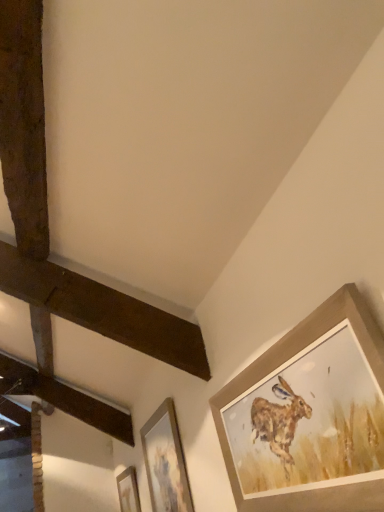
What is the approximate width of wooden picture frame at lower center, which is the first picture frame in left-to-right order?

wooden picture frame at lower center, which is the first picture frame in left-to-right order, is 1.90 inches in width.

The width and height of the screenshot is (384, 512). What do you see at coordinates (309, 415) in the screenshot?
I see `wooden picture frame at upper right, placed as the 1th picture frame when sorted from top to bottom` at bounding box center [309, 415].

What do you see at coordinates (166, 461) in the screenshot? I see `wooden picture frame at center, which appears as the 2th picture frame when viewed from the front` at bounding box center [166, 461].

Where is `wooden picture frame at lower center, the third picture frame when ordered from front to back`? The image size is (384, 512). wooden picture frame at lower center, the third picture frame when ordered from front to back is located at coordinates coord(128,490).

Looking at their sizes, would you say wooden picture frame at lower center, the 3th picture frame viewed from the right, is wider or thinner than wooden picture frame at center, the 2th picture frame in the bottom-to-top sequence?

Clearly, wooden picture frame at lower center, the 3th picture frame viewed from the right, has less width compared to wooden picture frame at center, the 2th picture frame in the bottom-to-top sequence.

Would you consider wooden picture frame at lower center, which is the 1th picture frame from back to front, to be distant from wooden picture frame at center, which appears as the 2th picture frame when viewed from the front?

Yes, wooden picture frame at lower center, which is the 1th picture frame from back to front, and wooden picture frame at center, which appears as the 2th picture frame when viewed from the front, are located far from each other.

At what (x,y) coordinates should I click in order to perform the action: click on picture frame that appears above the wooden picture frame at lower center, placed as the first picture frame when sorted from bottom to top (from a real-world perspective). Please return your answer as a coordinate pair (x, y). Looking at the image, I should click on (166, 461).

Could you tell me if wooden picture frame at lower center, which is the 1th picture frame from back to front, is facing wooden picture frame at center, placed as the second picture frame when sorted from left to right?

No.

Does wooden picture frame at center, the 2th picture frame from the right, turn towards wooden picture frame at lower center, which is the 1th picture frame from back to front?

No, wooden picture frame at center, the 2th picture frame from the right, is not facing towards wooden picture frame at lower center, which is the 1th picture frame from back to front.

Considering the sizes of wooden picture frame at center, the 2th picture frame viewed from the back, and wooden picture frame at lower center, positioned as the third picture frame in top-to-bottom order, in the image, is wooden picture frame at center, the 2th picture frame viewed from the back, taller or shorter than wooden picture frame at lower center, positioned as the third picture frame in top-to-bottom order,?

Clearly, wooden picture frame at center, the 2th picture frame viewed from the back, is taller compared to wooden picture frame at lower center, positioned as the third picture frame in top-to-bottom order.

Is wooden picture frame at center, the second picture frame when ordered from top to bottom, located outside wooden picture frame at lower center, the 3th picture frame viewed from the right?

Yes.

Can you tell me how much wooden picture frame at lower center, positioned as the third picture frame in top-to-bottom order, and wooden picture frame at upper right, marked as the 3th picture frame in a back-to-front arrangement, differ in facing direction?

There is a 0.000622-degree angle between the facing directions of wooden picture frame at lower center, positioned as the third picture frame in top-to-bottom order, and wooden picture frame at upper right, marked as the 3th picture frame in a back-to-front arrangement.

Is wooden picture frame at lower center, the third picture frame when ordered from front to back, positioned with its back to wooden picture frame at upper right, which is the 3th picture frame from bottom to top?

wooden picture frame at lower center, the third picture frame when ordered from front to back, does not have its back to wooden picture frame at upper right, which is the 3th picture frame from bottom to top.

Can you confirm if wooden picture frame at lower center, placed as the first picture frame when sorted from bottom to top, is wider than wooden picture frame at upper right, marked as the 3th picture frame in a back-to-front arrangement?

Incorrect, the width of wooden picture frame at lower center, placed as the first picture frame when sorted from bottom to top, does not surpass that of wooden picture frame at upper right, marked as the 3th picture frame in a back-to-front arrangement.

From the image's perspective, is wooden picture frame at lower center, which is the 1th picture frame from back to front, positioned above or below wooden picture frame at upper right, marked as the 3th picture frame in a back-to-front arrangement?

wooden picture frame at lower center, which is the 1th picture frame from back to front, is situated lower than wooden picture frame at upper right, marked as the 3th picture frame in a back-to-front arrangement, in the image.

Which of these two, wooden picture frame at upper right, marked as the 3th picture frame in a back-to-front arrangement, or wooden picture frame at center, placed as the second picture frame when sorted from left to right, is bigger?

Bigger between the two is wooden picture frame at upper right, marked as the 3th picture frame in a back-to-front arrangement.

Between wooden picture frame at upper right, which is the 3th picture frame from bottom to top, and wooden picture frame at center, the 2th picture frame in the bottom-to-top sequence, which one appears on the right side from the viewer's perspective?

Positioned to the right is wooden picture frame at upper right, which is the 3th picture frame from bottom to top.

Based on the photo, does wooden picture frame at upper right, marked as the 3th picture frame in a back-to-front arrangement, have a lesser height compared to wooden picture frame at lower center, the third picture frame when ordered from front to back?

No, wooden picture frame at upper right, marked as the 3th picture frame in a back-to-front arrangement, is not shorter than wooden picture frame at lower center, the third picture frame when ordered from front to back.

Visually, is wooden picture frame at upper right, marked as the 3th picture frame in a back-to-front arrangement, positioned to the left or to the right of wooden picture frame at lower center, the 3th picture frame viewed from the right?

wooden picture frame at upper right, marked as the 3th picture frame in a back-to-front arrangement, is to the right of wooden picture frame at lower center, the 3th picture frame viewed from the right.

Where is `picture frame directly beneath the wooden picture frame at lower center, which is the 1th picture frame from back to front (from a real-world perspective)`? picture frame directly beneath the wooden picture frame at lower center, which is the 1th picture frame from back to front (from a real-world perspective) is located at coordinates (309, 415).

Is wooden picture frame at center, the 2th picture frame viewed from the back, turned away from wooden picture frame at upper right, marked as the 3th picture frame in a back-to-front arrangement?

wooden picture frame at center, the 2th picture frame viewed from the back, does not have its back to wooden picture frame at upper right, marked as the 3th picture frame in a back-to-front arrangement.

Is the depth of wooden picture frame at center, which appears as the 2th picture frame when viewed from the front, less than that of wooden picture frame at upper right, acting as the first picture frame starting from the right?

No, wooden picture frame at center, which appears as the 2th picture frame when viewed from the front, is further to the viewer.

Considering the positions of points (185, 471) and (378, 477), is point (185, 471) closer to camera compared to point (378, 477)?

No, it is not.

Which picture frame is the 1st one when counting from the front of the wooden picture frame at lower center, which is the first picture frame in left-to-right order? Please provide its 2D coordinates.

[(166, 461)]

Locate an element on the screen. The height and width of the screenshot is (512, 384). picture frame that is below the wooden picture frame at center, the 2th picture frame in the bottom-to-top sequence (from the image's perspective) is located at coordinates (128, 490).

Looking at the image, which one is located further to wooden picture frame at lower center, the 3th picture frame viewed from the right, wooden picture frame at center, the 2th picture frame viewed from the back, or wooden picture frame at upper right, the third picture frame positioned from the left?

Based on the image, wooden picture frame at upper right, the third picture frame positioned from the left, appears to be further to wooden picture frame at lower center, the 3th picture frame viewed from the right.

Considering their positions, is wooden picture frame at lower center, the 3th picture frame viewed from the right, positioned closer to wooden picture frame at upper right, acting as the first picture frame starting from the right, than wooden picture frame at center, which appears as the 2th picture frame when viewed from the front?

Among the two, wooden picture frame at center, which appears as the 2th picture frame when viewed from the front, is located nearer to wooden picture frame at upper right, acting as the first picture frame starting from the right.

Based on their spatial positions, is wooden picture frame at upper right, marked as the 3th picture frame in a back-to-front arrangement, or wooden picture frame at lower center, which is the 1th picture frame from back to front, further from wooden picture frame at center, the 2th picture frame in the bottom-to-top sequence?

The object further to wooden picture frame at center, the 2th picture frame in the bottom-to-top sequence, is wooden picture frame at upper right, marked as the 3th picture frame in a back-to-front arrangement.

From the image, which object appears to be farther from wooden picture frame at lower center, which is the first picture frame in left-to-right order, wooden picture frame at upper right, the third picture frame positioned from the left, or wooden picture frame at center, the 2th picture frame in the bottom-to-top sequence?

wooden picture frame at upper right, the third picture frame positioned from the left, lies further to wooden picture frame at lower center, which is the first picture frame in left-to-right order, than the other object.

Looking at the image, which one is located further to wooden picture frame at upper right, which is the 3th picture frame from bottom to top, wooden picture frame at center, placed as the second picture frame when sorted from left to right, or wooden picture frame at lower center, placed as the first picture frame when sorted from bottom to top?

Among the two, wooden picture frame at lower center, placed as the first picture frame when sorted from bottom to top, is located further to wooden picture frame at upper right, which is the 3th picture frame from bottom to top.

Estimate the real-world distances between objects in this image. Which object is further from wooden picture frame at center, the 2th picture frame viewed from the back, wooden picture frame at lower center, the third picture frame when ordered from front to back, or wooden picture frame at upper right, marked as the 3th picture frame in a back-to-front arrangement?

Result: wooden picture frame at upper right, marked as the 3th picture frame in a back-to-front arrangement.

Image resolution: width=384 pixels, height=512 pixels. I want to click on picture frame between wooden picture frame at upper right, the third picture frame positioned from the left, and wooden picture frame at lower center, the 3th picture frame viewed from the right, from front to back, so click(166, 461).